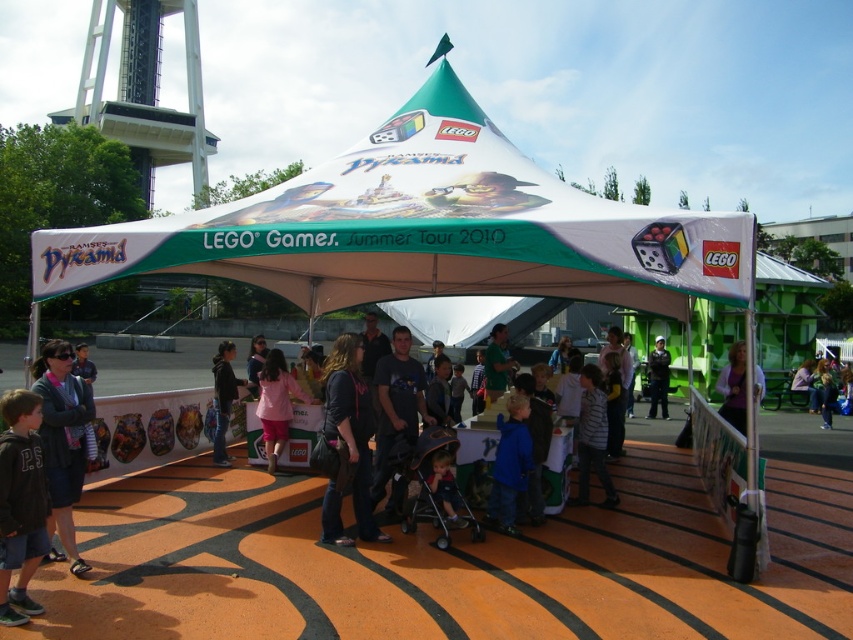
You are at the LEGO Games Summer Tour 2010 event and see two dark gray items. One is the dark gray sweater at lower left and the other is the dark gray hoodie at center. Which of these items is positioned higher up in the image?

The dark gray sweater at lower left is located above the dark gray hoodie at center, so it is positioned higher up in the image.

You are at the LEGO Games Summer Tour 2010 event and notice two people wearing dark blue jeans at center and dark gray hoodie at center. Which clothing item is positioned higher on their body?

The dark blue jeans at center is above the dark gray hoodie at center, so the dark blue jeans at center is positioned higher on their body.